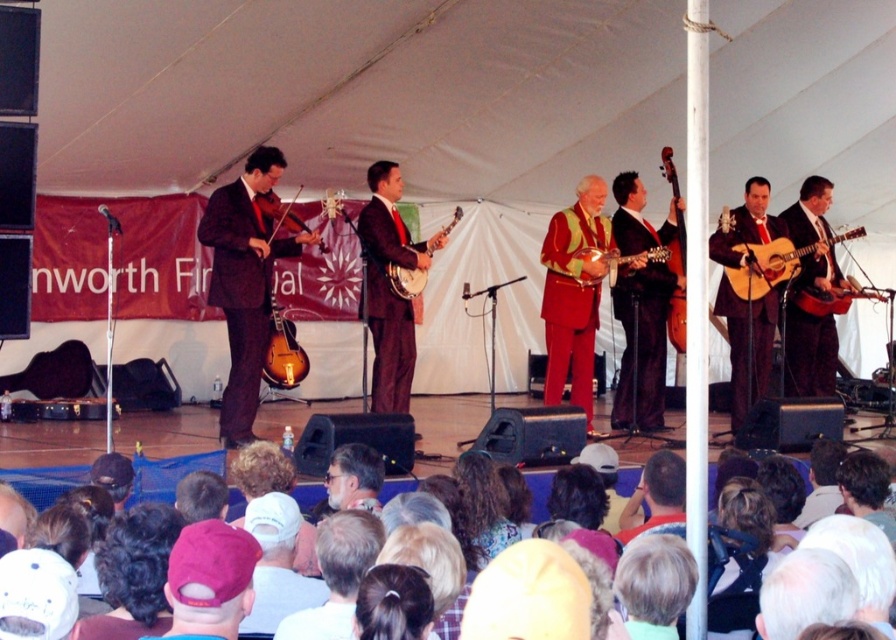
Which is more to the right, matte wood banjo at center or matte wood violin at center?

matte wood banjo at center is more to the right.

Is matte wood banjo at center to the right of matte wood violin at center from the viewer's perspective?

Yes, matte wood banjo at center is to the right of matte wood violin at center.

Measure the distance between matte wood banjo at center and camera.

matte wood banjo at center is 8.35 meters away from camera.

Image resolution: width=896 pixels, height=640 pixels. I want to click on matte wood banjo at center, so click(406, 280).

Does shiny dark suit at center have a smaller size compared to acoustic wood guitar at center right?

Incorrect, shiny dark suit at center is not smaller in size than acoustic wood guitar at center right.

Does shiny dark suit at center come behind acoustic wood guitar at center right?

No, shiny dark suit at center is in front of acoustic wood guitar at center right.

Describe the element at coordinates (390, 288) in the screenshot. I see `shiny dark suit at center` at that location.

The image size is (896, 640). I want to click on shiny dark suit at center, so click(x=390, y=288).

Measure the distance from shiny dark suit at center to sunburst wood mandolin at left.

shiny dark suit at center and sunburst wood mandolin at left are 1.09 meters apart.

Consider the image. Is shiny dark suit at center taller than sunburst wood mandolin at left?

Indeed, shiny dark suit at center has a greater height compared to sunburst wood mandolin at left.

Between point (389, 204) and point (294, 333), which one is positioned behind?

The point (294, 333) is behind.

Identify the location of shiny dark suit at center. tap(390, 288).